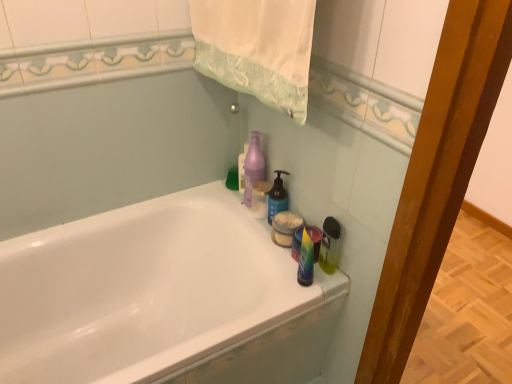
Question: Can you confirm if translucent plastic spray bottle at right, the first cleaning product in the right-to-left sequence, is wider than purple matte pump bottle at upper center, which is counted as the second cleaning product, starting from the left?

Choices:
 (A) no
 (B) yes

Answer: (A)

Question: Considering the relative positions of translucent plastic spray bottle at right, arranged as the fourth cleaning product when viewed from the left, and purple matte pump bottle at upper center, the third cleaning product from the right, in the image provided, is translucent plastic spray bottle at right, arranged as the fourth cleaning product when viewed from the left, to the right of purple matte pump bottle at upper center, the third cleaning product from the right, from the viewer's perspective?

Choices:
 (A) no
 (B) yes

Answer: (B)

Question: From the image's perspective, does translucent plastic spray bottle at right, the first cleaning product in the right-to-left sequence, appear lower than purple matte pump bottle at upper center, the third cleaning product from the right?

Choices:
 (A) no
 (B) yes

Answer: (B)

Question: Can we say translucent plastic spray bottle at right, arranged as the fourth cleaning product when viewed from the left, lies outside purple matte pump bottle at upper center, which is counted as the second cleaning product, starting from the left?

Choices:
 (A) yes
 (B) no

Answer: (A)

Question: Considering the relative sizes of translucent plastic spray bottle at right, arranged as the fourth cleaning product when viewed from the left, and purple matte pump bottle at upper center, which is counted as the second cleaning product, starting from the left, in the image provided, is translucent plastic spray bottle at right, arranged as the fourth cleaning product when viewed from the left, shorter than purple matte pump bottle at upper center, which is counted as the second cleaning product, starting from the left,?

Choices:
 (A) no
 (B) yes

Answer: (B)

Question: From the image's perspective, is translucent plastic spray bottle at right, arranged as the fourth cleaning product when viewed from the left, on top of purple matte pump bottle at upper center, the third cleaning product from the right?

Choices:
 (A) yes
 (B) no

Answer: (B)

Question: Does white glossy bathtub at upper center appear on the left side of translucent plastic spray bottle at right, arranged as the fourth cleaning product when viewed from the left?

Choices:
 (A) no
 (B) yes

Answer: (B)

Question: Is white glossy bathtub at upper center looking in the opposite direction of translucent plastic spray bottle at right, arranged as the fourth cleaning product when viewed from the left?

Choices:
 (A) no
 (B) yes

Answer: (A)

Question: From the image's perspective, is white glossy bathtub at upper center on translucent plastic spray bottle at right, the first cleaning product in the right-to-left sequence?

Choices:
 (A) yes
 (B) no

Answer: (B)

Question: Considering the relative positions of white glossy bathtub at upper center and translucent plastic spray bottle at right, the first cleaning product in the right-to-left sequence, in the image provided, is white glossy bathtub at upper center behind translucent plastic spray bottle at right, the first cleaning product in the right-to-left sequence,?

Choices:
 (A) no
 (B) yes

Answer: (A)

Question: From the image's perspective, is white glossy bathtub at upper center beneath translucent plastic spray bottle at right, arranged as the fourth cleaning product when viewed from the left?

Choices:
 (A) no
 (B) yes

Answer: (B)

Question: Does white glossy bathtub at upper center turn towards translucent plastic spray bottle at right, the first cleaning product in the right-to-left sequence?

Choices:
 (A) no
 (B) yes

Answer: (A)

Question: Is blue matte bottle at upper right, arranged as the second cleaning product when viewed from the right, inside white fabric towel at upper center?

Choices:
 (A) yes
 (B) no

Answer: (B)